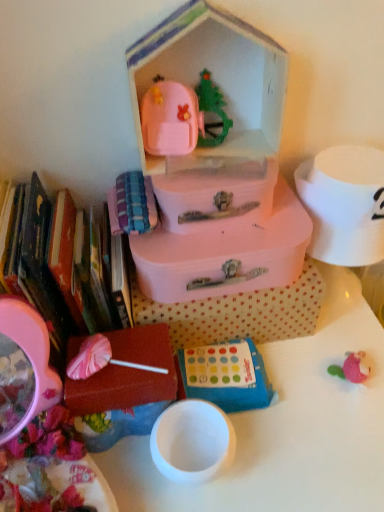
The width and height of the screenshot is (384, 512). Find the location of `vacant area in front of pink matte suitcase at center, the third storage box positioned from the top`. vacant area in front of pink matte suitcase at center, the third storage box positioned from the top is located at coordinates (293, 437).